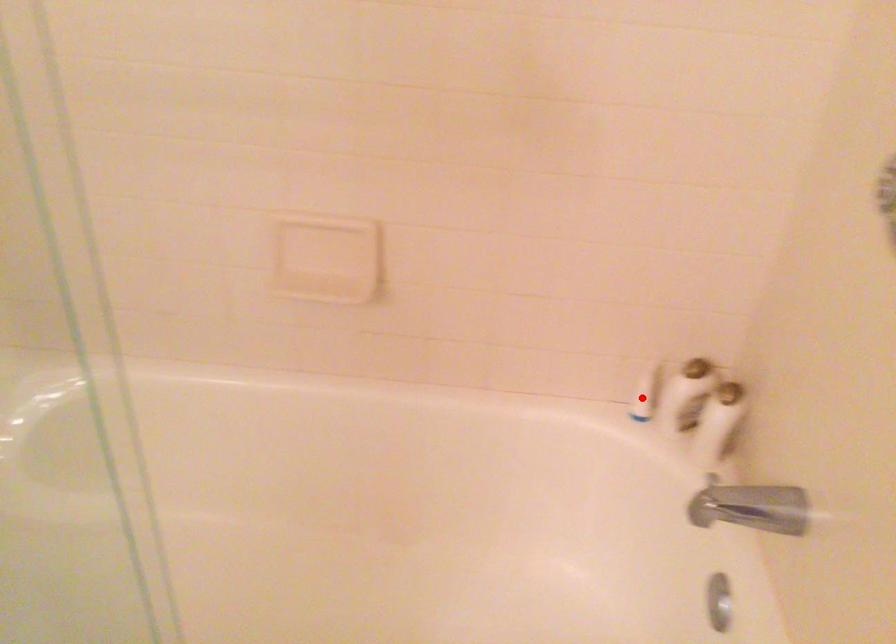
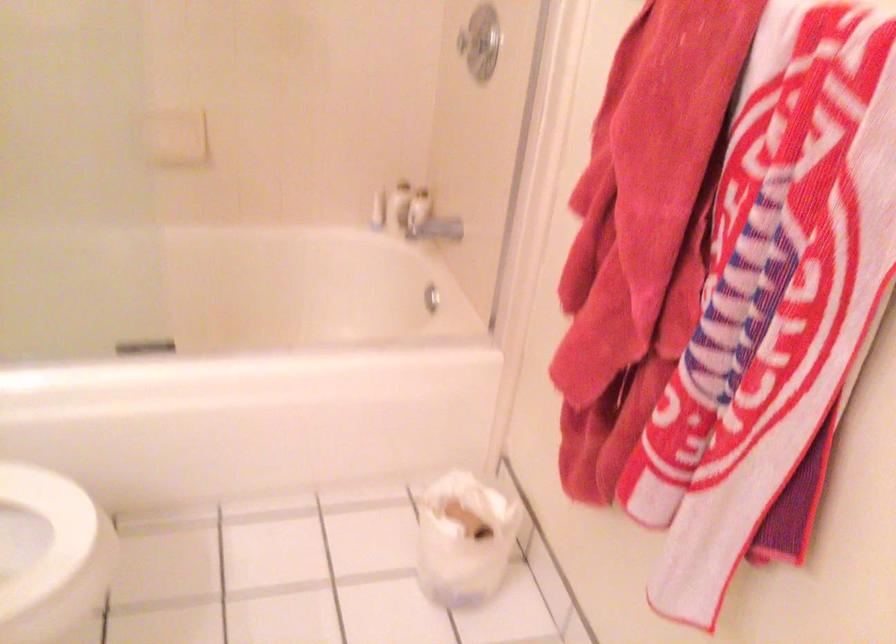
Locate, in the second image, the point that corresponds to the highlighted location in the first image.

(378, 211)